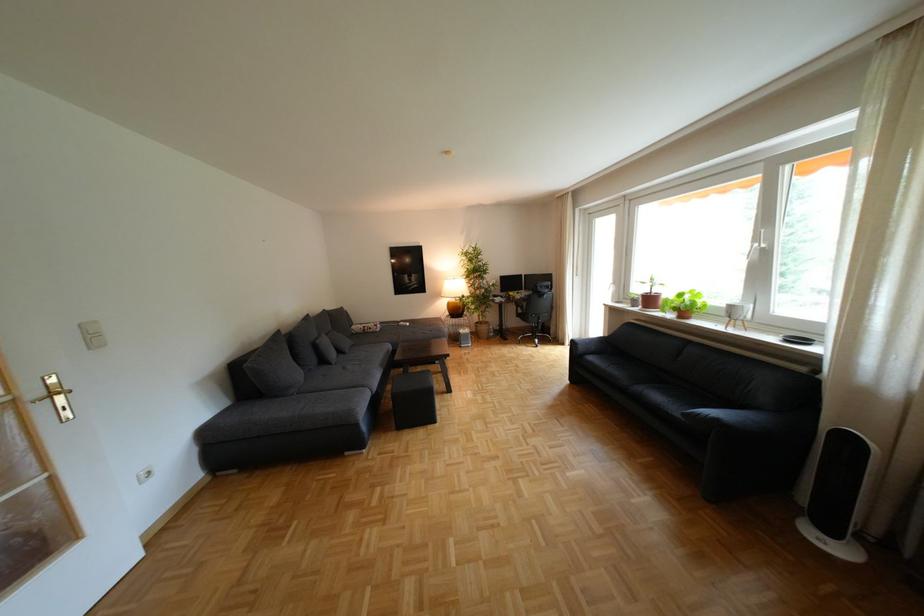
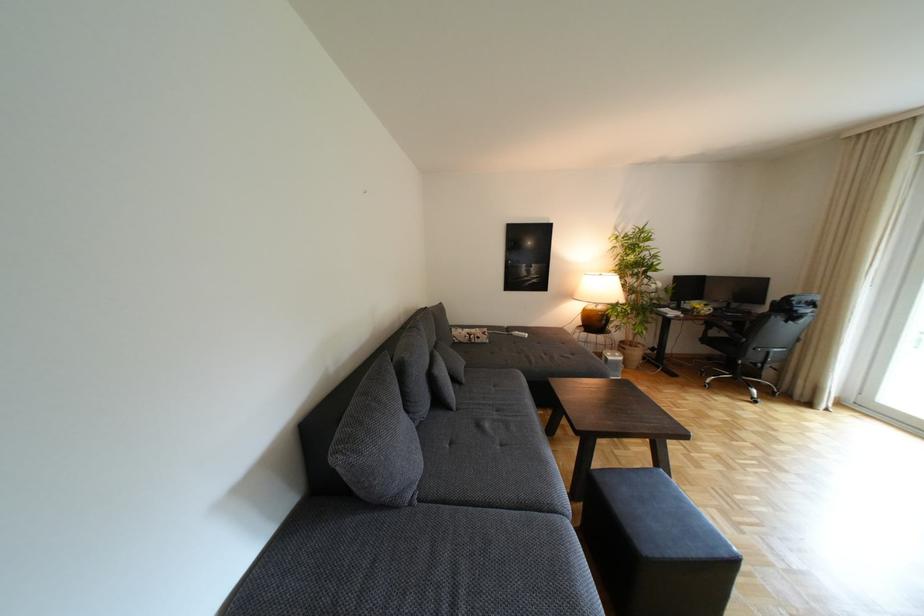
In a continuous first-person perspective shot, in which direction is the camera moving?

Result: The movement direction of the cameraman is left, forward.